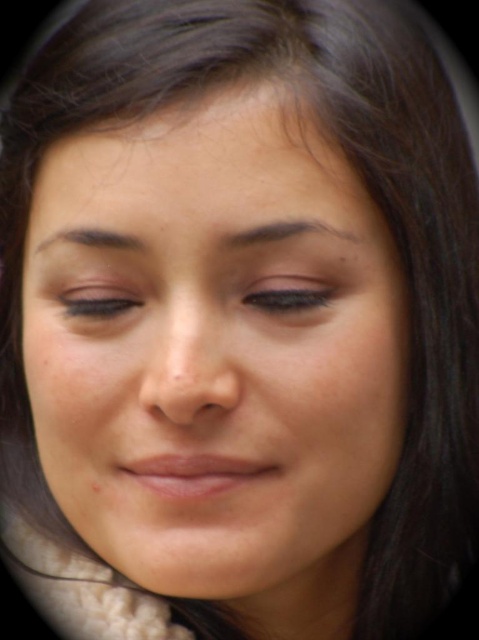
Which is in front, point (296, 120) or point (286, 301)?

Point (296, 120) is in front.

Which of these two, smooth skin face at center or matte black eye at upper center, stands taller?

With more height is smooth skin face at center.

Who is more forward, (288, 227) or (263, 289)?

Point (288, 227) is in front.

Identify the location of smooth skin face at center. The image size is (479, 640). (216, 348).

Can you confirm if smooth skin face at center is positioned to the right of matte black eye at center?

Correct, you'll find smooth skin face at center to the right of matte black eye at center.

Which is behind, point (305, 545) or point (101, 304)?

The point (305, 545) is behind.

You are a GUI agent. You are given a task and a screenshot of the screen. Output one action in this format:
    pyautogui.click(x=<x>, y=<y>)
    Task: Click on the smooth skin face at center
    The width and height of the screenshot is (479, 640).
    Given the screenshot: What is the action you would take?
    pyautogui.click(x=216, y=348)

The height and width of the screenshot is (640, 479). What do you see at coordinates (289, 296) in the screenshot? I see `matte black eye at upper center` at bounding box center [289, 296].

Is matte black eye at upper center shorter than matte black eye at center?

No, matte black eye at upper center is not shorter than matte black eye at center.

Is point (271, 289) closer to viewer compared to point (136, 288)?

Yes, point (271, 289) is closer to viewer.

Find the location of a particular element. The image size is (479, 640). matte black eye at upper center is located at coordinates [x=289, y=296].